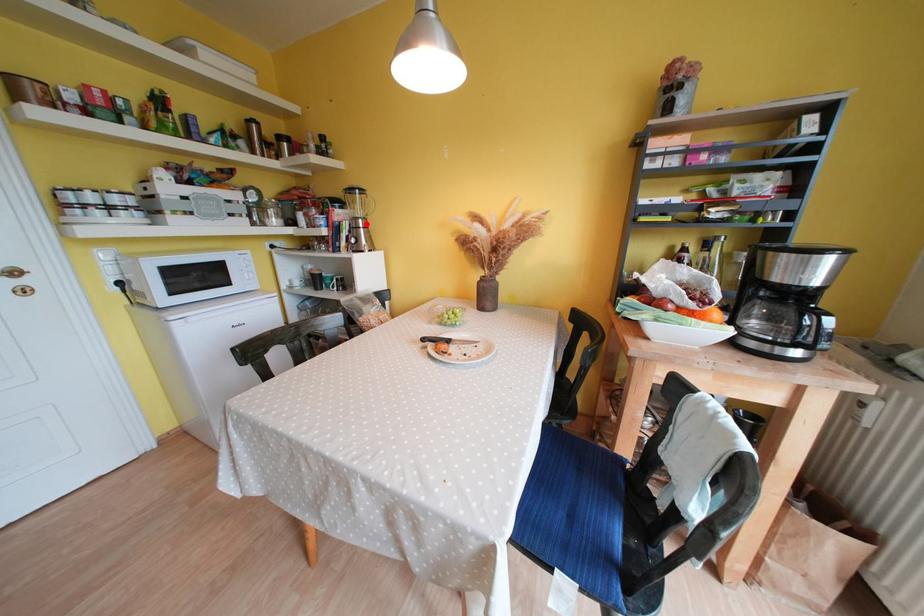
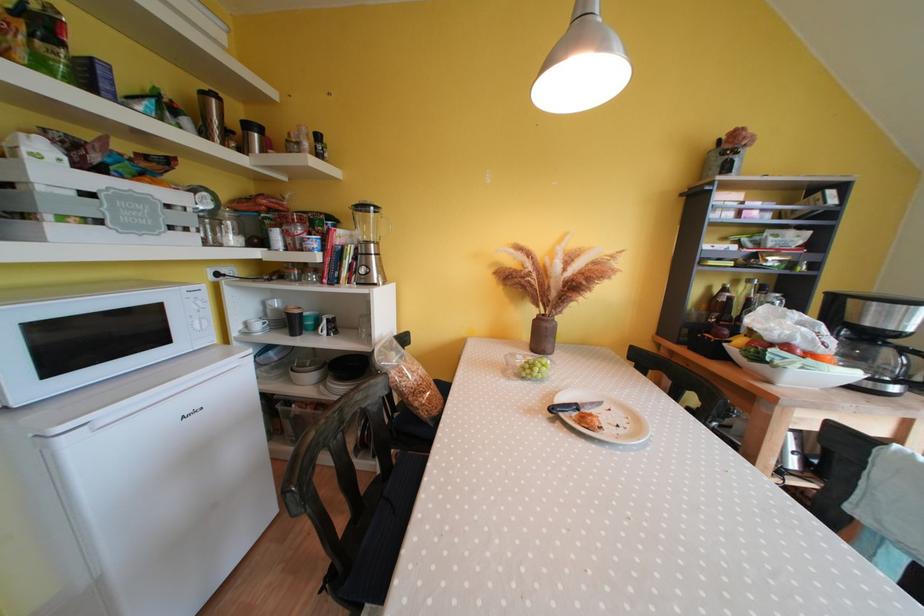
Where in the second image is the point corresponding to the highlighted location from the first image?

(379, 249)